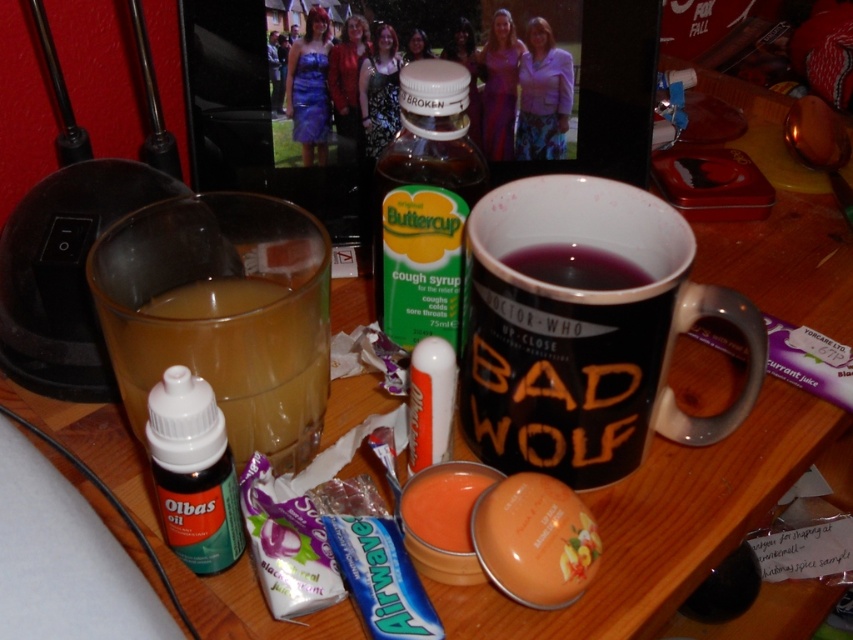
Question: Can you confirm if green plastic bottle at center is thinner than matte orange lip balm at center?

Choices:
 (A) no
 (B) yes

Answer: (A)

Question: Which of the following is the farthest from the observer?

Choices:
 (A) black matte mug at center
 (B) matte orange lip balm at center
 (C) translucent glass at left
 (D) green matte bottle at lower left

Answer: (A)

Question: Is green plastic bottle at center bigger than matte orange lip balm at center?

Choices:
 (A) no
 (B) yes

Answer: (B)

Question: Which object appears farthest from the camera in this image?

Choices:
 (A) green plastic bottle at center
 (B) matte orange lip balm at center
 (C) black matte mug at center
 (D) green matte bottle at lower left

Answer: (A)

Question: Which of the following is the closest to the observer?

Choices:
 (A) green matte bottle at lower left
 (B) black matte mug at center
 (C) matte orange lip balm at center

Answer: (A)

Question: Does black matte mug at center come behind green matte bottle at lower left?

Choices:
 (A) yes
 (B) no

Answer: (A)